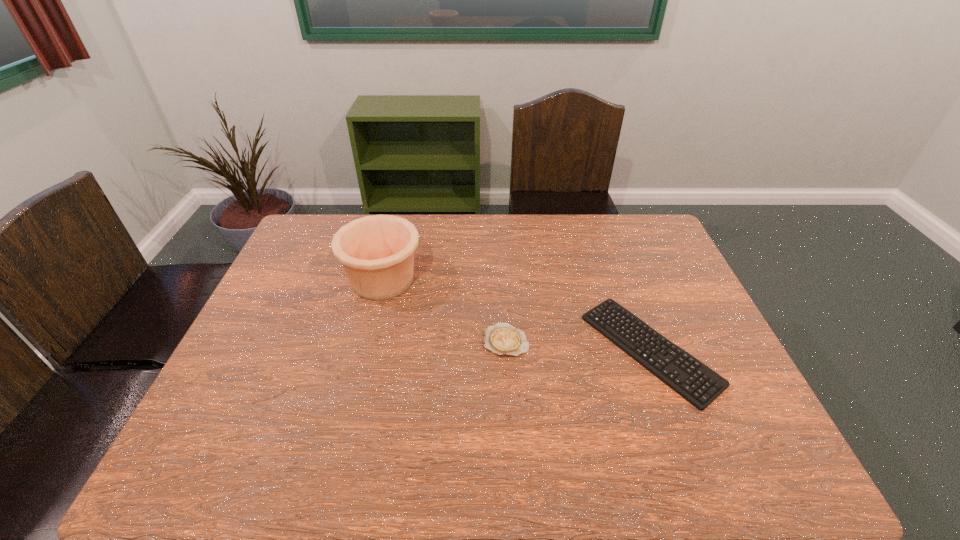
This screenshot has width=960, height=540. Find the location of `empty space between the second object from left to right and the tallest object`. empty space between the second object from left to right and the tallest object is located at coordinates (444, 310).

Locate an element on the screen. Image resolution: width=960 pixels, height=540 pixels. vacant space that is in between the pottery and the computer keyboard is located at coordinates (516, 315).

The height and width of the screenshot is (540, 960). Identify the location of free space between the rightmost object and the second object from right to left. (578, 345).

The height and width of the screenshot is (540, 960). Find the location of `the closest object to the leftmost object`. the closest object to the leftmost object is located at coordinates (502, 339).

Choose which object is the second nearest neighbor to the computer keyboard. Please provide its 2D coordinates. Your answer should be formatted as a tuple, i.e. [(x, y)], where the tuple contains the x and y coordinates of a point satisfying the conditions above.

[(377, 252)]

Locate an element on the screen. The image size is (960, 540). vacant space that satisfies the following two spatial constraints: 1. on the front side of the computer keyboard; 2. on the right side of the pottery is located at coordinates (366, 349).

Identify the location of free space that satisfies the following two spatial constraints: 1. on the front side of the second object from left to right; 2. on the right side of the computer keyboard. The height and width of the screenshot is (540, 960). (507, 349).

You are a GUI agent. You are given a task and a screenshot of the screen. Output one action in this format:
    pyautogui.click(x=<x>, y=<y>)
    Task: Click on the vacant space that satisfies the following two spatial constraints: 1. on the front side of the leftmost object; 2. on the right side of the quiche
    
    Given the screenshot: What is the action you would take?
    point(368,341)

Identify the location of free location that satisfies the following two spatial constraints: 1. on the front side of the rightmost object; 2. on the left side of the tallest object. (366, 349).

I want to click on vacant area that satisfies the following two spatial constraints: 1. on the front side of the quiche; 2. on the left side of the leftmost object, so click(x=368, y=341).